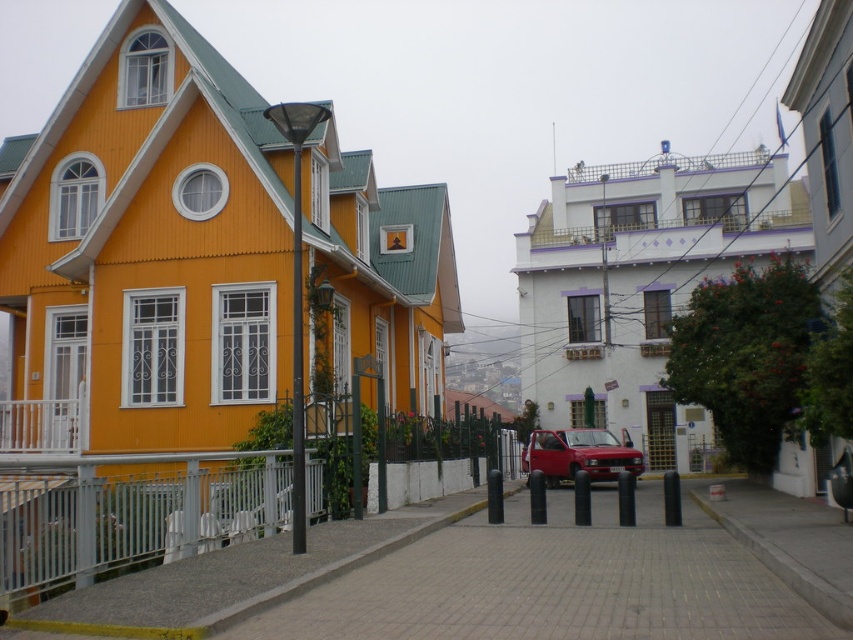
Describe the element at coordinates (131, 509) in the screenshot. I see `white painted metal railing at lower left` at that location.

Is white painted metal railing at lower left above matte red car at center?

Indeed, white painted metal railing at lower left is positioned over matte red car at center.

Is point (190, 525) positioned in front of point (567, 448)?

Yes, point (190, 525) is in front of point (567, 448).

In order to click on white painted metal railing at lower left in this screenshot , I will do `click(131, 509)`.